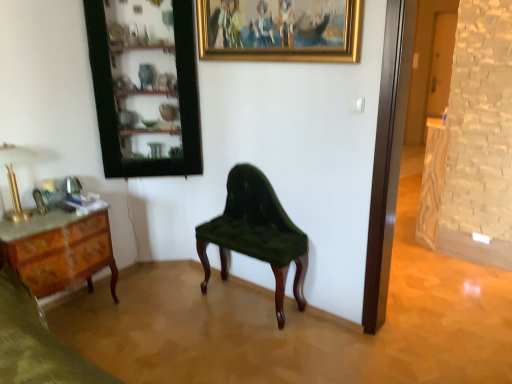
Where is `vacant space to the right of gold polished metal lamp at left`? The width and height of the screenshot is (512, 384). vacant space to the right of gold polished metal lamp at left is located at coordinates (51, 220).